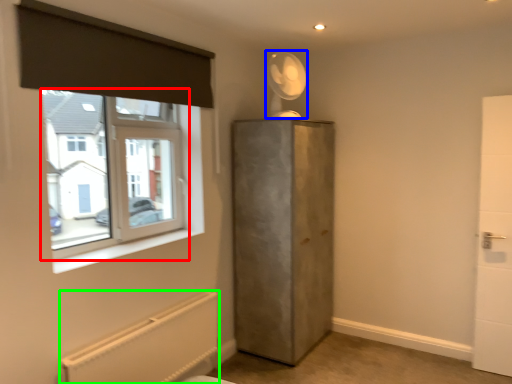
Question: Considering the real-world distances, which object is closest to window (highlighted by a red box)? fan (highlighted by a blue box) or radiator (highlighted by a green box).

Choices:
 (A) fan
 (B) radiator

Answer: (B)